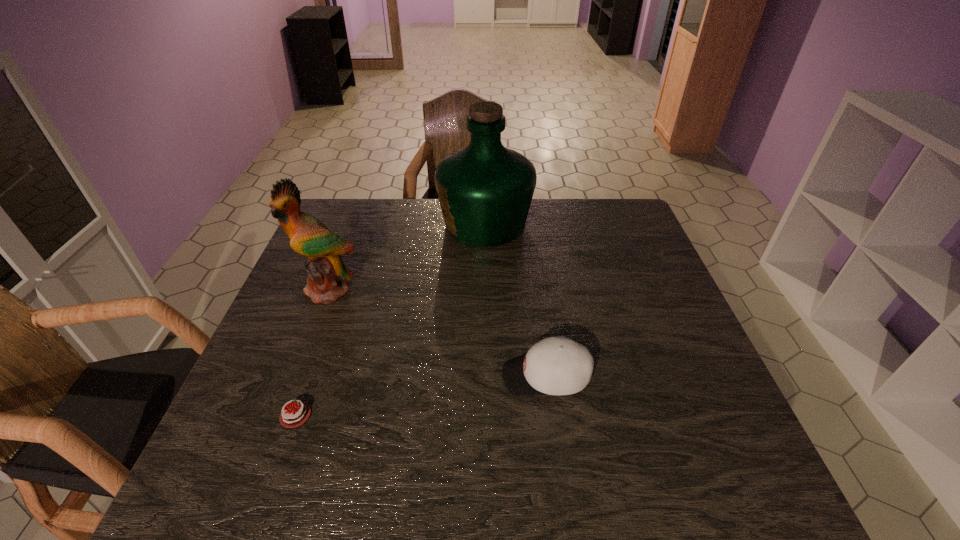
Locate an element on the screen. The height and width of the screenshot is (540, 960). vacant space at the far right corner of the desktop is located at coordinates (627, 233).

In the image, there is a desktop. Where is `vacant space at the near right corner`? vacant space at the near right corner is located at coordinates (764, 495).

Find the location of a particular element. The image size is (960, 540). vacant region between the shortest object and the liquor is located at coordinates (391, 320).

Find the location of a particular element. vacant point located between the parrot and the baseball cap is located at coordinates (437, 333).

The width and height of the screenshot is (960, 540). Find the location of `free space between the third nearest object and the shortest object`. free space between the third nearest object and the shortest object is located at coordinates (312, 353).

The image size is (960, 540). I want to click on vacant space in between the chocolate cake and the liquor, so click(x=391, y=320).

Find the location of `vacant space in between the shortest object and the liquor`. vacant space in between the shortest object and the liquor is located at coordinates (391, 320).

At what (x,y) coordinates should I click in order to perform the action: click on vacant space in between the parrot and the chocolate cake. Please return your answer as a coordinate pair (x, y). Looking at the image, I should click on (312, 353).

Where is `vacant area that lies between the second shortest object and the parrot`? vacant area that lies between the second shortest object and the parrot is located at coordinates (437, 333).

The height and width of the screenshot is (540, 960). I want to click on vacant space that is in between the farthest object and the parrot, so click(x=407, y=257).